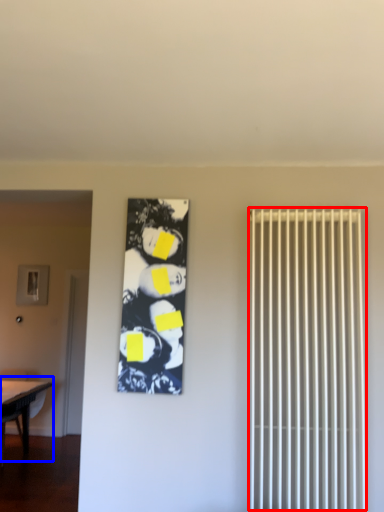
Question: Which of the following is the closest to the observer, radiator (highlighted by a red box) or table (highlighted by a blue box)?

Choices:
 (A) radiator
 (B) table

Answer: (A)